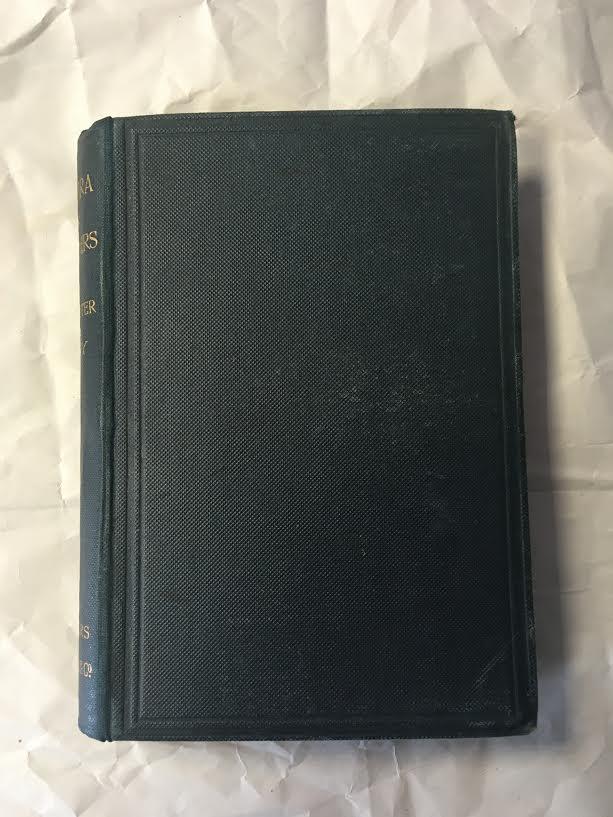
At what (x,y) coordinates should I click in order to perform the action: click on inlay. Please return your answer as a coordinate pair (x, y). Image resolution: width=613 pixels, height=817 pixels. Looking at the image, I should click on (137, 182).